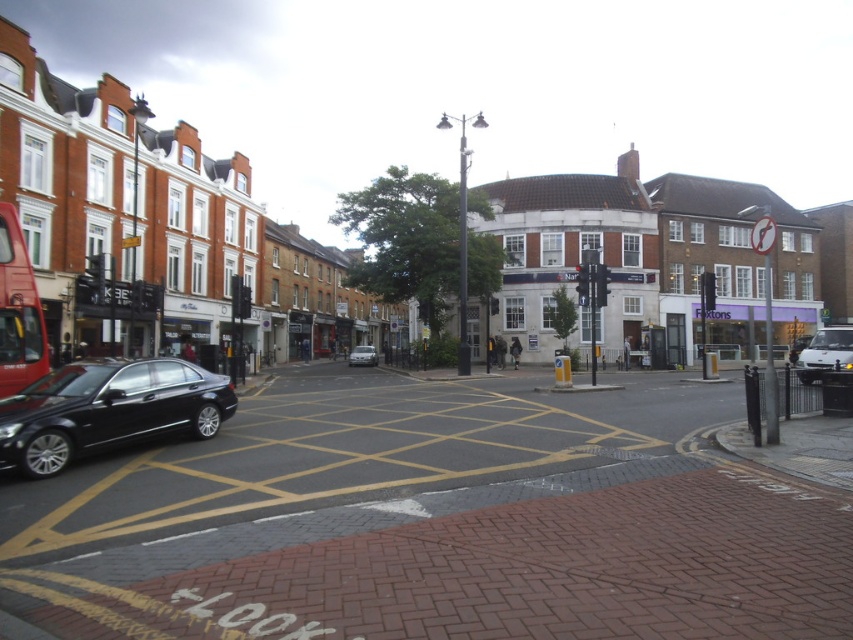
From the picture: You are a delivery person standing at the pedestrian crossing in the image. You need to reach the shiny black sedan at lower left to drop off a package. What is the shortest path you can take from your current position to the sedan?

The shortest path would be to move directly towards the shiny black sedan at lower left, which is located at coordinates point [107,410]. Since you are at the pedestrian crossing, you can walk straight along the yellow markings towards the sedan without crossing any roads or obstacles.